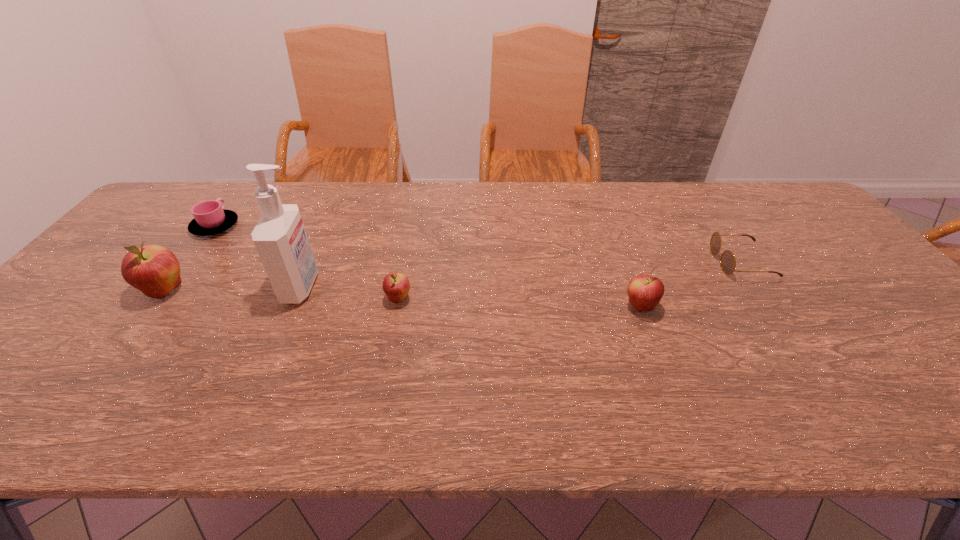
All apples are currently evenly spaced. To continue this pattern, where would you add another apple on the right? Please point out a vacant spot. Please provide its 2D coordinates. Your answer should be formatted as a tuple, i.e. [(x, y)], where the tuple contains the x and y coordinates of a point satisfying the conditions above.

[(892, 315)]